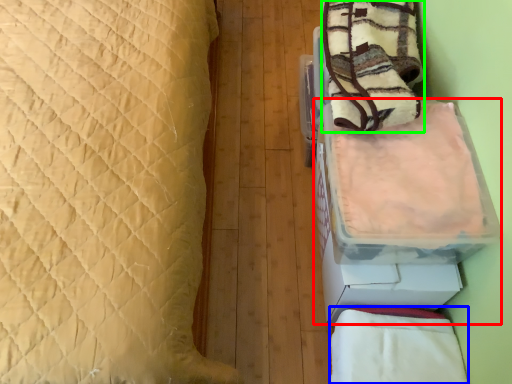
Question: Based on their relative distances, which object is nearer to cardboard box (highlighted by a red box)? Choose from blanket (highlighted by a blue box) and blanket (highlighted by a green box).

Choices:
 (A) blanket
 (B) blanket

Answer: (A)